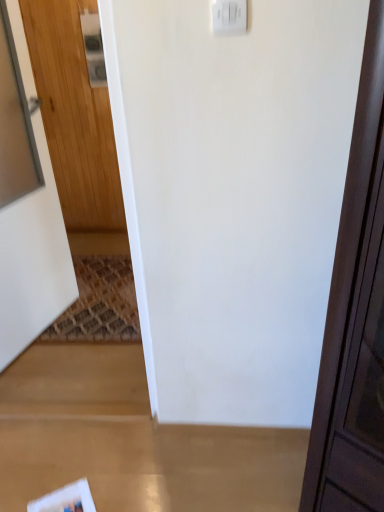
Question: Should I look upward or downward to see white glossy magazine at lower left?

Choices:
 (A) up
 (B) down

Answer: (B)

Question: Does white glossy magazine at lower left turn towards white plastic light switch at upper center, which ranks as the second light switch in top-to-bottom order?

Choices:
 (A) no
 (B) yes

Answer: (A)

Question: Can you confirm if white glossy magazine at lower left is smaller than white plastic light switch at upper center, arranged as the first light switch when viewed from the right?

Choices:
 (A) no
 (B) yes

Answer: (A)

Question: Is white glossy magazine at lower left beside white plastic light switch at upper center, arranged as the first light switch when viewed from the right?

Choices:
 (A) yes
 (B) no

Answer: (B)

Question: From a real-world perspective, is white glossy magazine at lower left on white plastic light switch at upper center, which ranks as the second light switch in top-to-bottom order?

Choices:
 (A) no
 (B) yes

Answer: (A)

Question: Is white glossy magazine at lower left outside white plastic light switch at upper center, the 1th light switch in the bottom-to-top sequence?

Choices:
 (A) yes
 (B) no

Answer: (A)

Question: Are white glossy magazine at lower left and white plastic light switch at upper center, the first light switch in the front-to-back sequence, far apart?

Choices:
 (A) yes
 (B) no

Answer: (A)

Question: From a real-world perspective, does white plastic light switch at upper center, the 2th light switch positioned from the right, sit lower than wooden door at left?

Choices:
 (A) yes
 (B) no

Answer: (B)

Question: Does white plastic light switch at upper center, which appears as the 2th light switch when ordered from the bottom, appear on the right side of wooden door at left?

Choices:
 (A) yes
 (B) no

Answer: (A)

Question: Is white plastic light switch at upper center, the first light switch from the top, completely or partially outside of wooden door at left?

Choices:
 (A) no
 (B) yes

Answer: (B)

Question: Is white plastic light switch at upper center, which is the 2th light switch from front to back, bigger than wooden door at left?

Choices:
 (A) yes
 (B) no

Answer: (B)

Question: Is wooden door at left a part of white plastic light switch at upper center, placed as the first light switch when sorted from back to front?

Choices:
 (A) yes
 (B) no

Answer: (B)

Question: Considering the relative positions of white plastic light switch at upper center, positioned as the first light switch in left-to-right order, and wooden door at left in the image provided, is white plastic light switch at upper center, positioned as the first light switch in left-to-right order, behind wooden door at left?

Choices:
 (A) no
 (B) yes

Answer: (B)

Question: From the image's perspective, is white glossy magazine at lower left above wooden door at left?

Choices:
 (A) no
 (B) yes

Answer: (A)